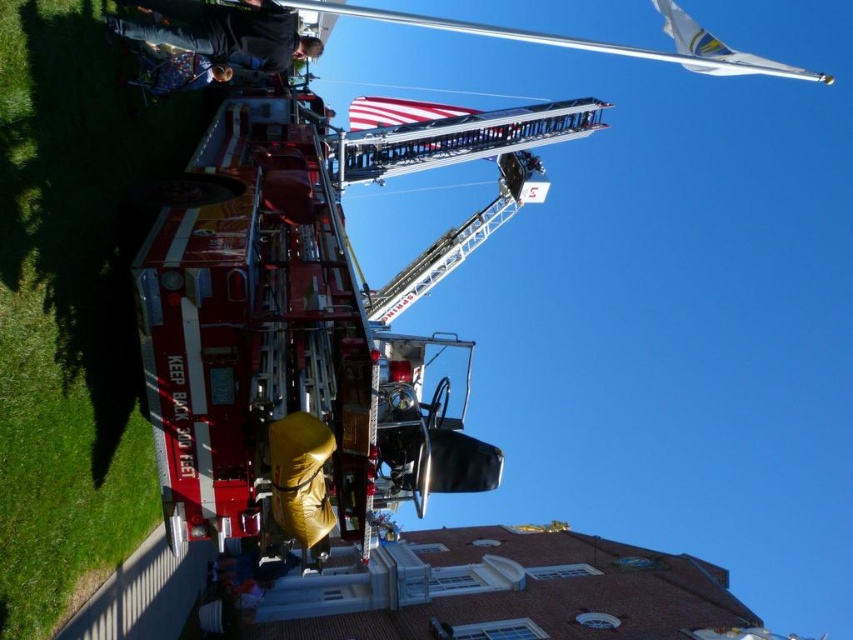
You are standing in the grassy area next to the brick building and see the red metallic fire truck at center and the blue denim jacket at upper left. Which object is nearer to you?

The red metallic fire truck at center is closer to the viewer than the blue denim jacket at upper left.

You are standing at the origin point in the image. The red metallic fire truck at center is at coordinates 0.506, 0.363. If you want to move directly towards it, which direction should you head?

The red metallic fire truck at center is located at coordinates (309, 323), so you should head towards the center of the image to reach it.

From the picture: You are a firefighter who needs to quickly access the blue denim jacket at upper left while the red metallic fire truck at center is in the way. Can you easily reach the jacket without moving the truck?

The red metallic fire truck at center is taller than the blue denim jacket at upper left, so you can easily reach the jacket without moving the truck since it is shorter and likely within reach around or over the truck.